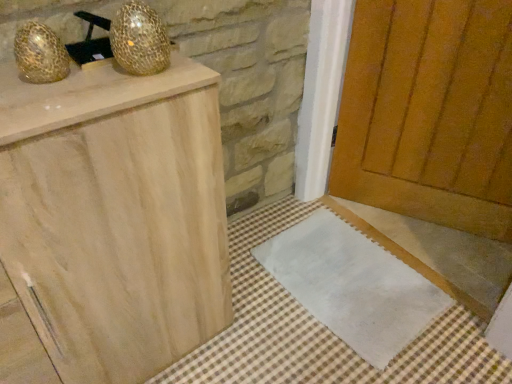
You are a GUI agent. You are given a task and a screenshot of the screen. Output one action in this format:
    pyautogui.click(x=<x>, y=<y>)
    Task: Click on the vacant space in front of gold textured egg at upper left, the second disco ball viewed from the right
    This screenshot has height=384, width=512.
    Given the screenshot: What is the action you would take?
    pyautogui.click(x=44, y=102)